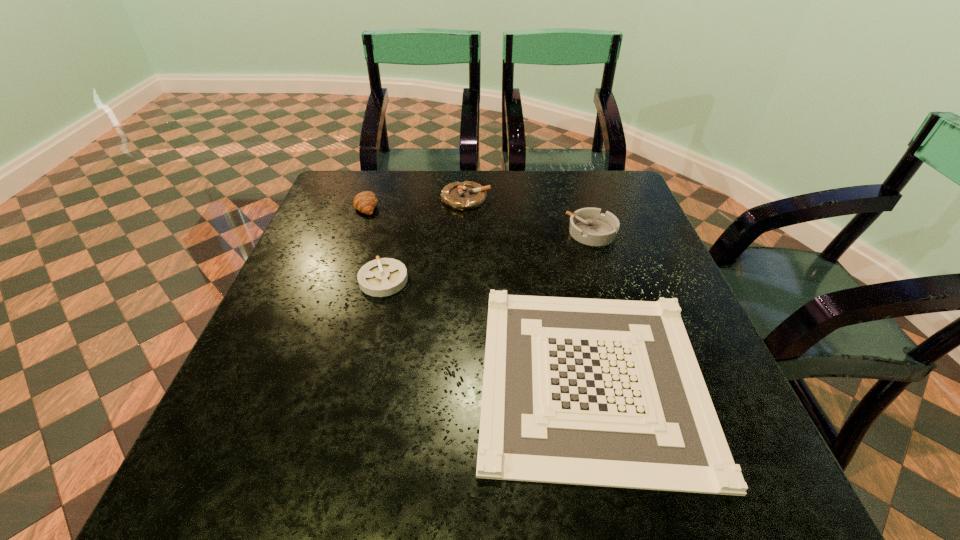
Locate an element on the screen. This screenshot has width=960, height=540. vacant region at the far edge is located at coordinates (400, 202).

Where is `blank area at the near edge`? The height and width of the screenshot is (540, 960). blank area at the near edge is located at coordinates (583, 486).

In the image, there is a desktop. Where is `vacant space at the left edge`? The width and height of the screenshot is (960, 540). vacant space at the left edge is located at coordinates (311, 254).

In the image, there is a desktop. Where is `free space at the right edge`? The height and width of the screenshot is (540, 960). free space at the right edge is located at coordinates (646, 241).

This screenshot has width=960, height=540. Find the location of `vacant space at the far right corner of the desktop`. vacant space at the far right corner of the desktop is located at coordinates (607, 195).

The height and width of the screenshot is (540, 960). Identify the location of vacant point located between the third farthest object and the second ashtray from left to right. (529, 215).

Where is `free spot between the third farthest object and the fourth tallest object`? The image size is (960, 540). free spot between the third farthest object and the fourth tallest object is located at coordinates (488, 256).

This screenshot has height=540, width=960. I want to click on unoccupied position between the second ashtray from left to right and the rightmost ashtray, so click(x=529, y=215).

Identify the location of free spot between the shortest object and the crescent roll. This screenshot has width=960, height=540. (480, 291).

Locate an element on the screen. The image size is (960, 540). empty space that is in between the third nearest object and the second ashtray from left to right is located at coordinates (529, 215).